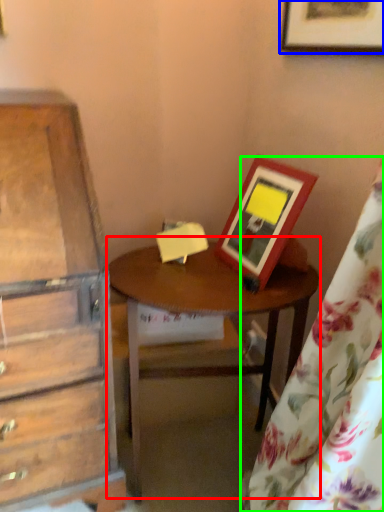
Question: Which is farther away from table (highlighted by a red box)? picture frame (highlighted by a blue box) or curtain (highlighted by a green box)?

Choices:
 (A) picture frame
 (B) curtain

Answer: (A)